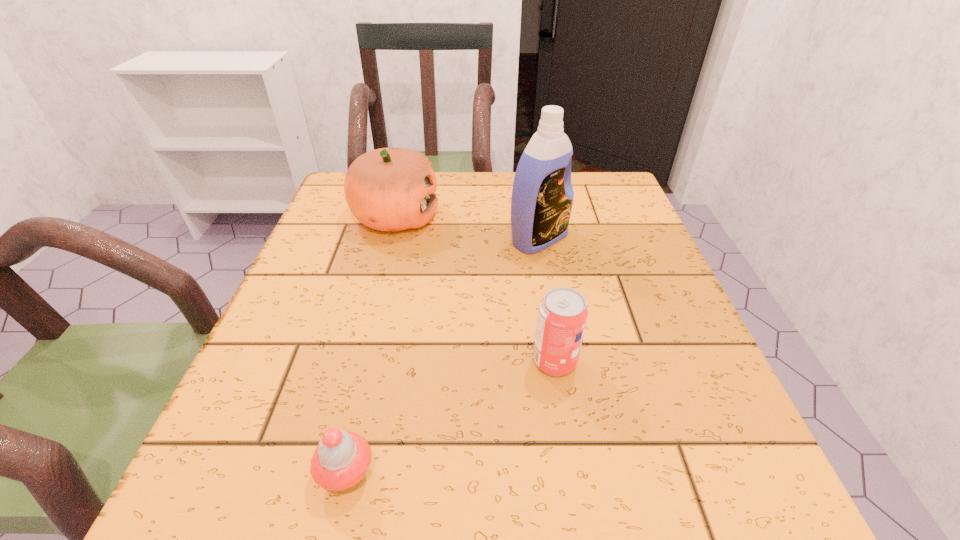
Identify the location of detergent present at the far edge. This screenshot has width=960, height=540. [x=542, y=197].

Locate an element on the screen. The height and width of the screenshot is (540, 960). pumpkin located in the far edge section of the desktop is located at coordinates pos(389,189).

Find the location of a particular element. The image size is (960, 540). object present at the near edge is located at coordinates (340, 462).

You are a GUI agent. You are given a task and a screenshot of the screen. Output one action in this format:
    pyautogui.click(x=<x>, y=<y>)
    Task: Click on the pumpkin positioned at the left edge
    This screenshot has width=960, height=540.
    Given the screenshot: What is the action you would take?
    pyautogui.click(x=389, y=189)

The height and width of the screenshot is (540, 960). I want to click on cupcake present at the left edge, so click(340, 462).

Locate an element on the screen. The width and height of the screenshot is (960, 540). object at the far left corner is located at coordinates click(x=389, y=189).

At what (x,y) coordinates should I click in order to perform the action: click on object located at the near left corner. Please return your answer as a coordinate pair (x, y). This screenshot has width=960, height=540. Looking at the image, I should click on (340, 462).

Identify the location of vacant space at the far edge of the desktop. The image size is (960, 540). (444, 210).

Find the location of a particular element. This screenshot has width=960, height=540. vacant space at the near edge of the desktop is located at coordinates (460, 471).

I want to click on vacant space at the left edge of the desktop, so click(x=304, y=284).